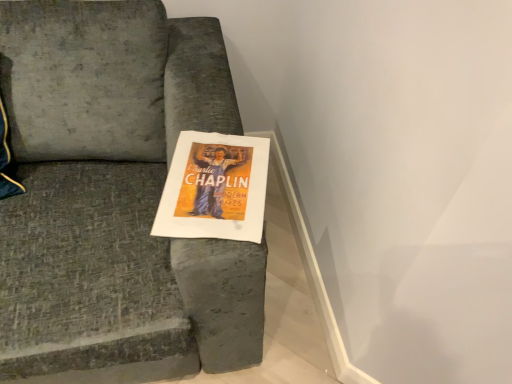
Question: Is the depth of matte paper poster at center greater than that of velvet gray couch at center?

Choices:
 (A) yes
 (B) no

Answer: (A)

Question: Considering the relative sizes of matte paper poster at center and velvet gray couch at center in the image provided, is matte paper poster at center shorter than velvet gray couch at center?

Choices:
 (A) yes
 (B) no

Answer: (A)

Question: Does matte paper poster at center appear on the right side of velvet gray couch at center?

Choices:
 (A) no
 (B) yes

Answer: (B)

Question: Considering the relative sizes of matte paper poster at center and velvet gray couch at center in the image provided, is matte paper poster at center smaller than velvet gray couch at center?

Choices:
 (A) no
 (B) yes

Answer: (B)

Question: Is matte paper poster at center far away from velvet gray couch at center?

Choices:
 (A) no
 (B) yes

Answer: (A)

Question: Is matte paper poster at center wider than velvet gray couch at center?

Choices:
 (A) yes
 (B) no

Answer: (B)

Question: Is velvet gray couch at center outside of matte paper poster at center?

Choices:
 (A) yes
 (B) no

Answer: (A)

Question: Considering the relative sizes of velvet gray couch at center and matte paper poster at center in the image provided, is velvet gray couch at center shorter than matte paper poster at center?

Choices:
 (A) yes
 (B) no

Answer: (B)

Question: Could you tell me if velvet gray couch at center is facing matte paper poster at center?

Choices:
 (A) yes
 (B) no

Answer: (A)

Question: Is the depth of velvet gray couch at center greater than that of matte paper poster at center?

Choices:
 (A) no
 (B) yes

Answer: (A)

Question: Considering the relative sizes of velvet gray couch at center and matte paper poster at center in the image provided, is velvet gray couch at center thinner than matte paper poster at center?

Choices:
 (A) yes
 (B) no

Answer: (B)

Question: From the image's perspective, is velvet gray couch at center beneath matte paper poster at center?

Choices:
 (A) no
 (B) yes

Answer: (A)

Question: Is point (218, 233) positioned closer to the camera than point (38, 117)?

Choices:
 (A) closer
 (B) farther

Answer: (A)